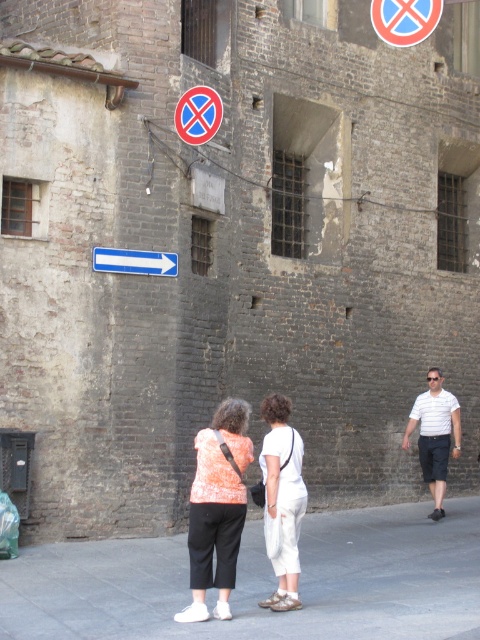
You are a photographer positioned to capture the two women in the scene. Which woman, the one wearing the orange printed blouse at center or the white cotton shirt at right, will appear larger in the photo?

The orange printed blouse at center will appear larger in the photo because it is in front of the white cotton shirt at right, making it closer to the camera.

Consider the image. You are a photographer trying to capture a detailed shot of the orange printed blouse at center. Given that your camera has a focus point at the center of the image, which is at coordinate point 0.5 on both axes, will the blouse be in focus?

The orange printed blouse at center is located at point 0.795 on the x and y axes, which is further from the center point 0.5, so it may not be in focus unless the camera adjusts the focus point.